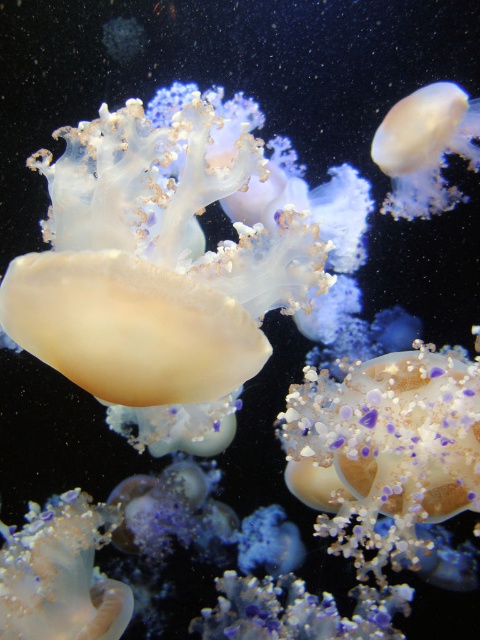
You are a marine biologist observing the underwater scene. You notice two points of interest labeled as point (x=11, y=563) and point (x=456, y=92). Which point is nearer to your viewpoint?

Point (x=11, y=563) is closer to the camera than point (x=456, y=92).